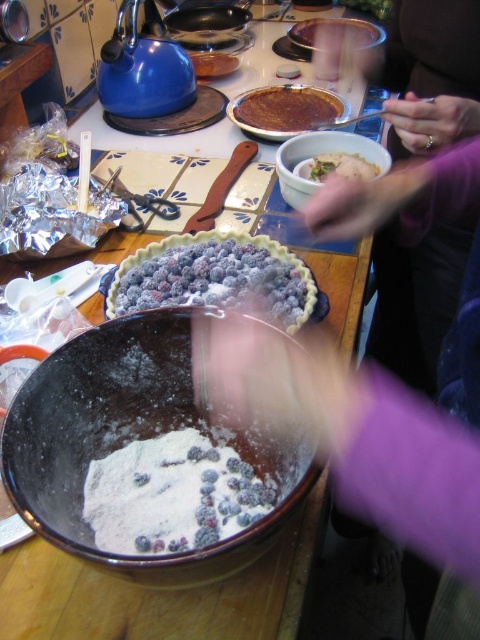
You are a baker who needs to choose between the blueberry pie crust at center and the brown crumbly pie crust at center for a recipe that requires a taller crust. Which one should you pick?

The brown crumbly pie crust at center is taller than the blueberry pie crust at center, so you should choose the brown crumbly pie crust at center for your recipe.

You are a chef standing in front of the kitchen scene. You need to reach the point at coordinates (x=140, y=275). Given that your arm can extend 30 inches, can you reach that point without moving your position?

The distance between the point at coordinates (x=140, y=275) and the camera is 32.17 inches. Since your arm can only extend 30 inches, you cannot reach that point without moving your position.

You are a chef preparing a pie and need to check the position of the blueberry pie crust at center and the green leafy vegetable at upper center. Which one is higher up in the image?

The green leafy vegetable at upper center is higher up in the image than the blueberry pie crust at center.